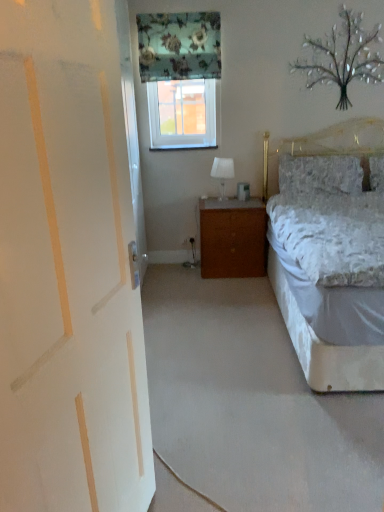
I want to click on vacant space underneath floral fabric curtain at upper center (from a real-world perspective), so click(x=173, y=258).